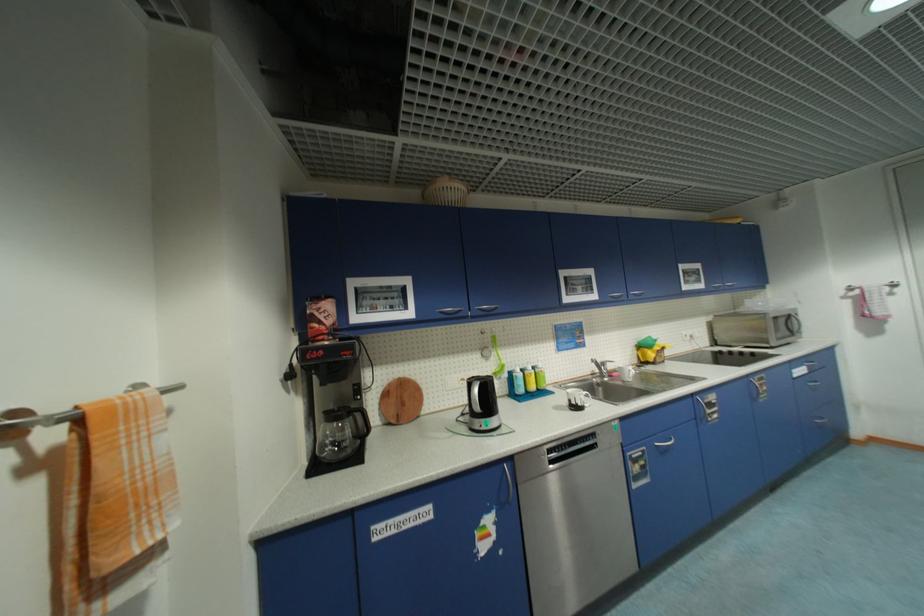
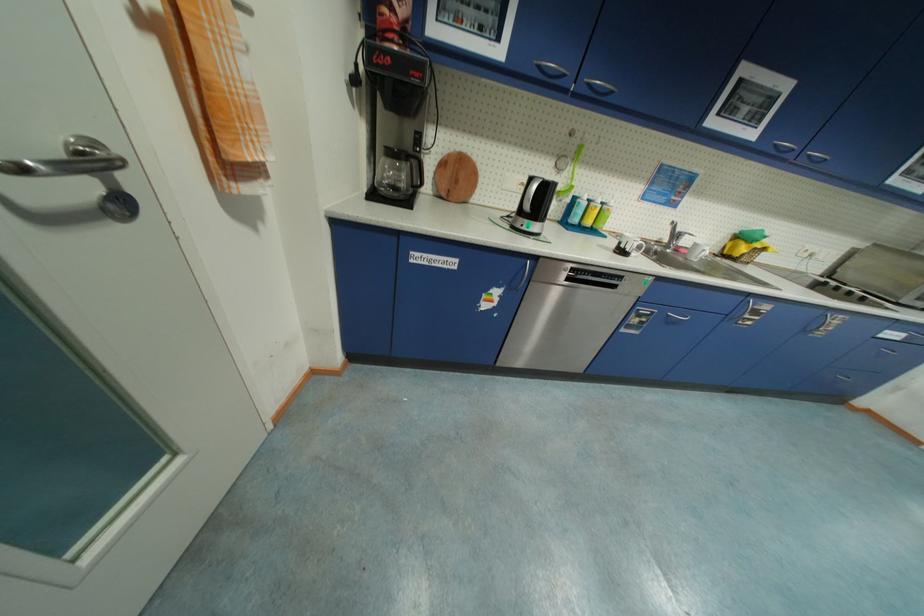
Where in the second image is the point corresponding to [579,403] from the first image?

(627, 246)